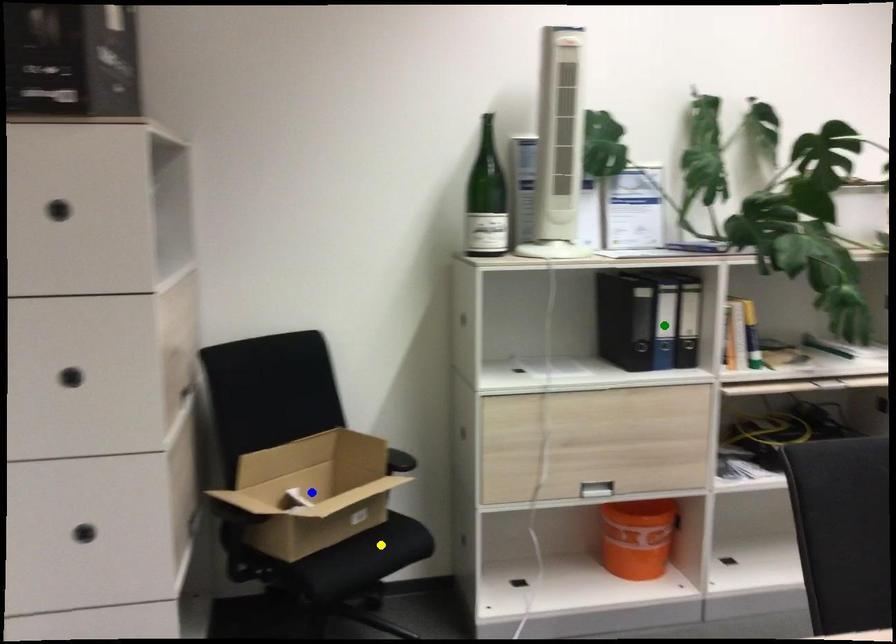
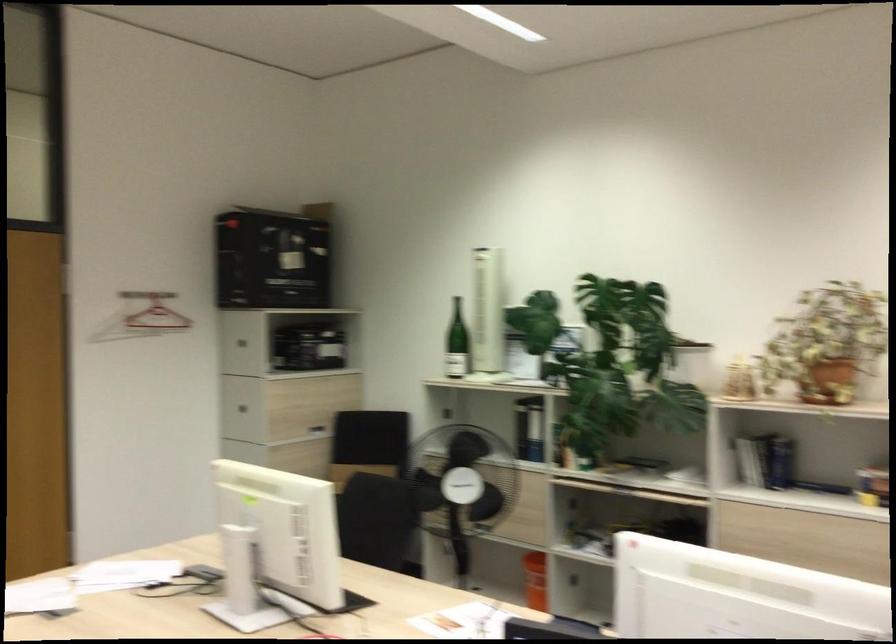
I am providing you with two images of the same scene from different viewpoints. Three points are marked in image1. Which point corresponds to a part or object that is occluded in image2?In image1, three points are marked. Which of them correspond to a part or object that is occluded in image2?Among the three points shown in image1, which one corresponds to a part or object that is no longer visible due to occlusion in image2?

Invisible in image2: blue point, yellow point, green point.